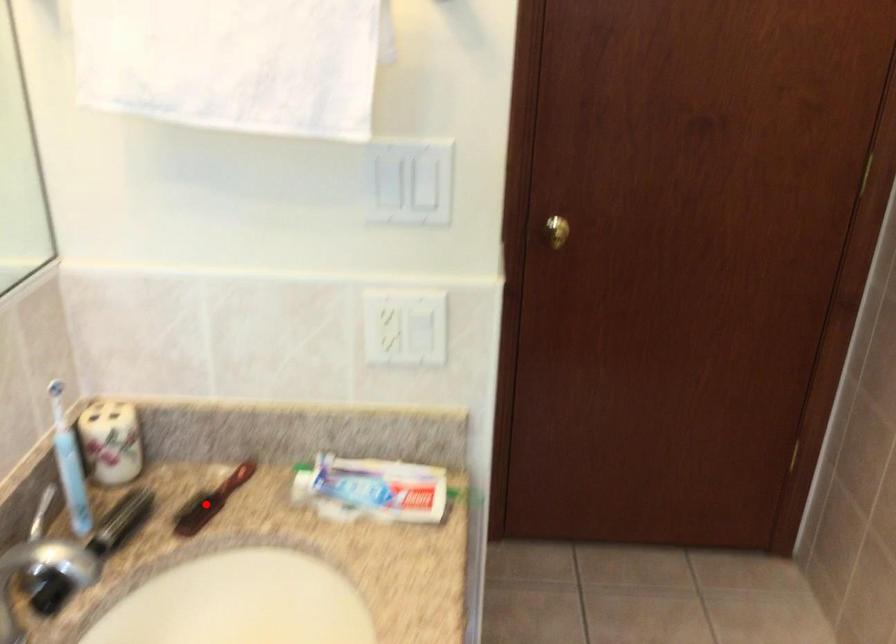
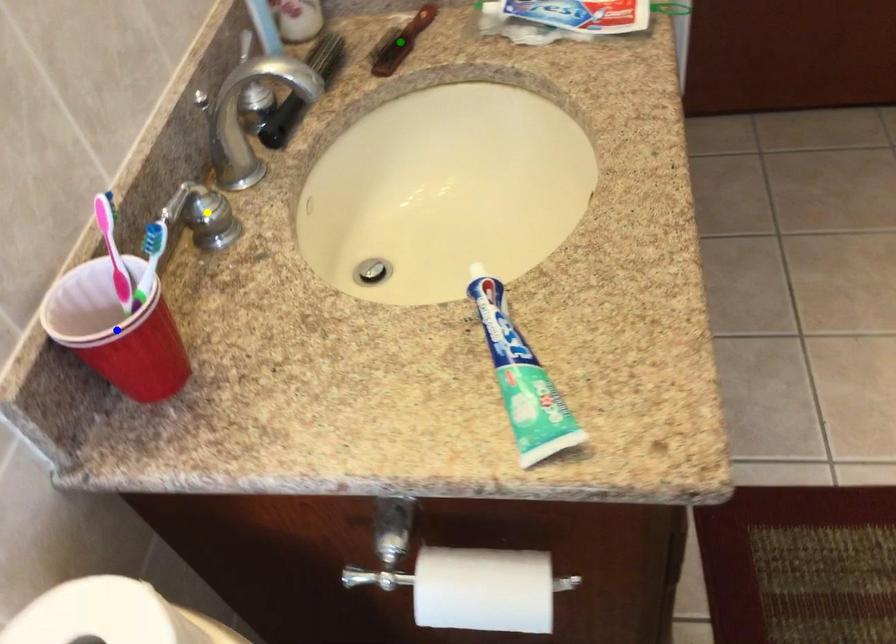
Question: I am providing you with two images of the same scene from different viewpoints. A red point is marked on the first image. You are given multiple points on the second image. In image 2, which mark is for the same physical point as the one in image 1?

Choices:
 (A) blue point
 (B) yellow point
 (C) green point

Answer: (C)